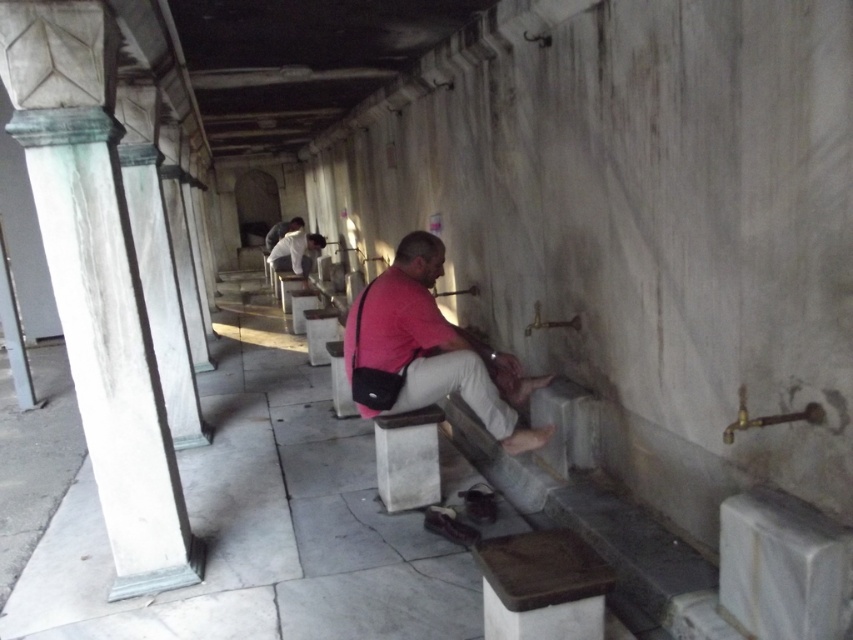
Based on the photo, is white marble stool at lower center above white shirt at center?

Incorrect, white marble stool at lower center is not positioned above white shirt at center.

Is white marble stool at lower center taller than white shirt at center?

No, white marble stool at lower center is not taller than white shirt at center.

Identify the location of white marble stool at lower center. (407, 458).

The image size is (853, 640). What are the coordinates of `white marble stool at lower center` in the screenshot? It's located at 407,458.

Who is shorter, white shirt at center or matte pink shirt at center?

matte pink shirt at center

Does point (276, 266) come closer to viewer compared to point (277, 225)?

Yes.

Locate an element on the screen. The image size is (853, 640). white shirt at center is located at coordinates (294, 252).

Can you confirm if pink matte shirt at center is taller than white shirt at center?

Yes.

Can you confirm if pink matte shirt at center is positioned to the left of white shirt at center?

Incorrect, pink matte shirt at center is not on the left side of white shirt at center.

Find the location of a particular element. Image resolution: width=853 pixels, height=640 pixels. pink matte shirt at center is located at coordinates (428, 352).

Find the location of a particular element. This screenshot has height=640, width=853. pink matte shirt at center is located at coordinates (428, 352).